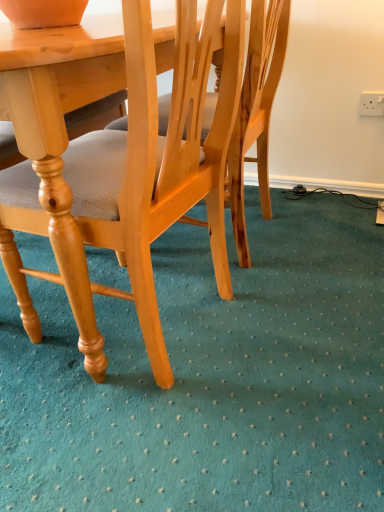
Question: Is the position of white plastic power outlet at upper right more distant than that of light wood chair at center?

Choices:
 (A) yes
 (B) no

Answer: (A)

Question: Is white plastic power outlet at upper right bigger than light wood chair at center?

Choices:
 (A) no
 (B) yes

Answer: (A)

Question: From a real-world perspective, is white plastic power outlet at upper right physically below light wood chair at center?

Choices:
 (A) yes
 (B) no

Answer: (A)

Question: Is there a large distance between white plastic power outlet at upper right and light wood chair at center?

Choices:
 (A) no
 (B) yes

Answer: (B)

Question: Is white plastic power outlet at upper right completely or partially outside of light wood chair at center?

Choices:
 (A) no
 (B) yes

Answer: (B)

Question: From the image's perspective, is white plastic power outlet at upper right under light wood chair at center?

Choices:
 (A) yes
 (B) no

Answer: (B)

Question: Is light wood chair at center taller than white plastic power outlet at upper right?

Choices:
 (A) yes
 (B) no

Answer: (A)

Question: From a real-world perspective, is light wood chair at center located beneath white plastic power outlet at upper right?

Choices:
 (A) yes
 (B) no

Answer: (B)

Question: Can you confirm if light wood chair at center is positioned to the right of white plastic power outlet at upper right?

Choices:
 (A) yes
 (B) no

Answer: (B)

Question: Is light wood chair at center outside white plastic power outlet at upper right?

Choices:
 (A) no
 (B) yes

Answer: (B)

Question: Is the position of light wood chair at center less distant than that of white plastic power outlet at upper right?

Choices:
 (A) no
 (B) yes

Answer: (B)

Question: Would you say light wood chair at center is a long distance from white plastic power outlet at upper right?

Choices:
 (A) no
 (B) yes

Answer: (B)

Question: Is light wood chair at center inside the boundaries of white plastic power outlet at upper right, or outside?

Choices:
 (A) inside
 (B) outside

Answer: (B)